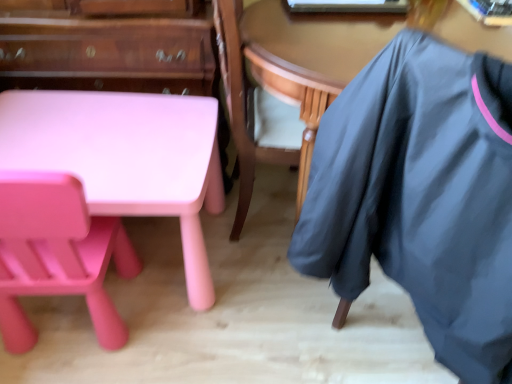
Question: Which is correct: matte pink plastic desk at lower left is inside wooden table at center, or outside of it?

Choices:
 (A) outside
 (B) inside

Answer: (A)

Question: From the image's perspective, relative to wooden table at center, is matte pink plastic desk at lower left above or below?

Choices:
 (A) below
 (B) above

Answer: (A)

Question: Which of these objects is positioned closest to the dark gray fabric at right?

Choices:
 (A) wooden table at center
 (B) matte pink plastic desk at lower left
 (C) matte pink table at lower left
 (D) matte pink chair at lower left

Answer: (A)

Question: Estimate the real-world distances between objects in this image. Which object is farther from the matte pink chair at lower left?

Choices:
 (A) wooden table at center
 (B) dark gray fabric at right
 (C) matte pink plastic desk at lower left
 (D) matte pink table at lower left

Answer: (A)